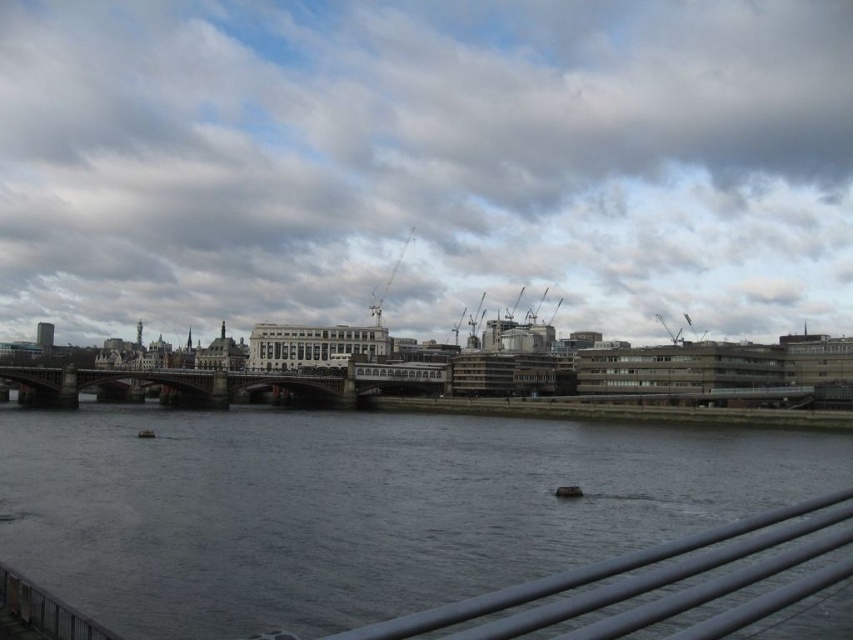
In the scene shown: Between dark gray water at center and dark gray metallic boat at center, which one has more height?

Standing taller between the two is dark gray water at center.

Is dark gray water at center further to the viewer compared to dark gray metallic boat at center?

That is False.

Locate an element on the screen. dark gray water at center is located at coordinates 352,492.

Based on the photo, is dark gray water at center positioned in front of satin silver rail at lower center?

No.

Is dark gray water at center thinner than satin silver rail at lower center?

In fact, dark gray water at center might be wider than satin silver rail at lower center.

Is point (170, 481) positioned in front of point (689, 628)?

No, (170, 481) is behind (689, 628).

Find the location of a particular element. This screenshot has width=853, height=640. dark gray water at center is located at coordinates pos(352,492).

Can you confirm if cloudy sky at upper center is positioned above dark gray metallic boat at center?

Correct, cloudy sky at upper center is located above dark gray metallic boat at center.

Does cloudy sky at upper center appear on the right side of dark gray metallic boat at center?

In fact, cloudy sky at upper center is to the left of dark gray metallic boat at center.

Does point (816, 164) come farther from viewer compared to point (579, 492)?

Yes, it is.

Image resolution: width=853 pixels, height=640 pixels. I want to click on cloudy sky at upper center, so click(x=424, y=161).